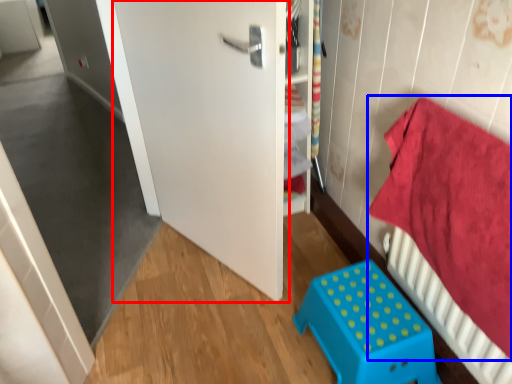
Question: Among these objects, which one is nearest to the camera, door (highlighted by a red box) or bedding (highlighted by a blue box)?

Choices:
 (A) door
 (B) bedding

Answer: (B)